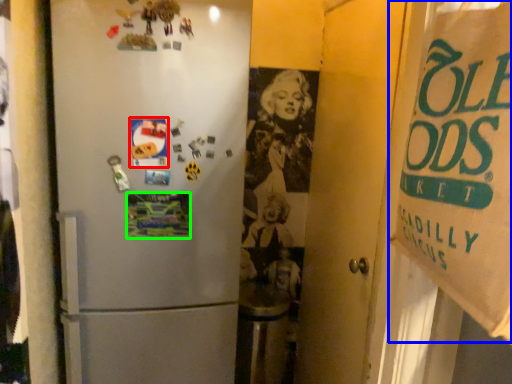
Question: Estimate the real-world distances between objects in this image. Which object is farther from postcard (highlighted by a red box), poster (highlighted by a blue box) or postcard (highlighted by a green box)?

Choices:
 (A) poster
 (B) postcard

Answer: (A)